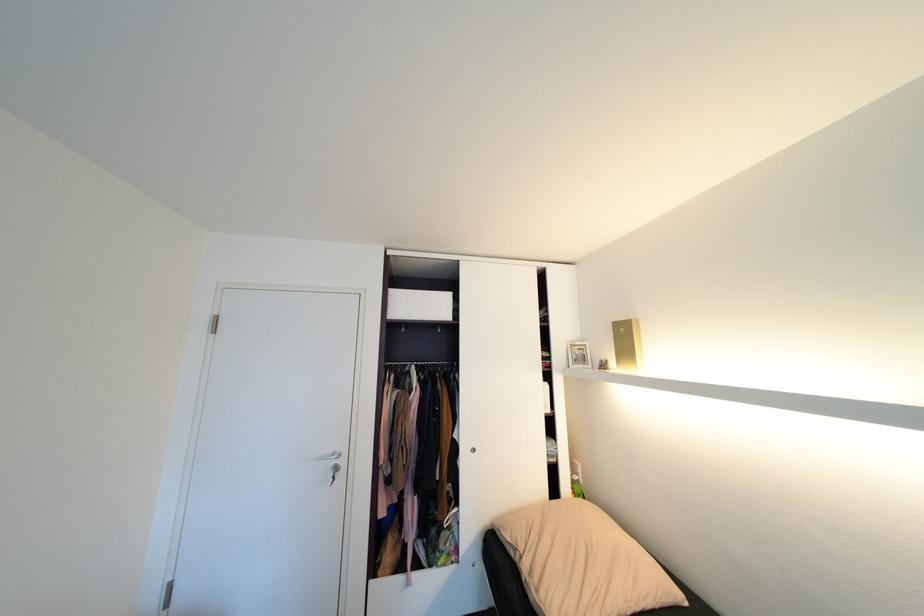
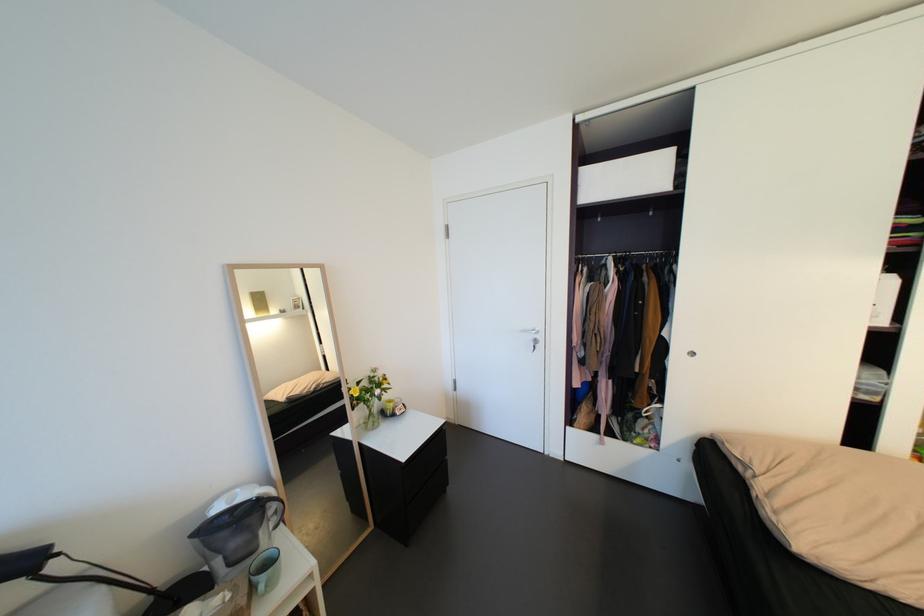
Based on the continuous images, in which direction is the camera rotating?

The rotation direction of the camera is left-down.